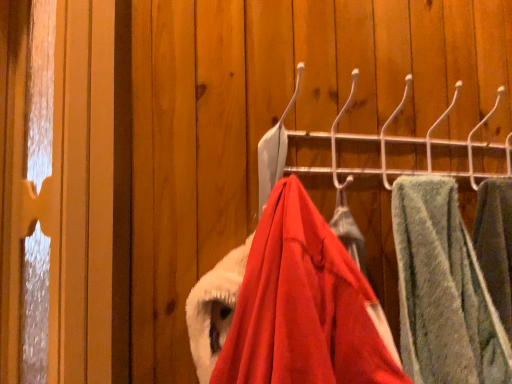
Question: Which direction should I rotate to face velvet red coat at center, which is the 2th closet in top-to-bottom order, — up or down?

Choices:
 (A) up
 (B) down

Answer: (B)

Question: Considering the relative sizes of metallic hook rack at center, which ranks as the second closet in bottom-to-top order, and green fuzzy towel at right in the image provided, is metallic hook rack at center, which ranks as the second closet in bottom-to-top order, wider than green fuzzy towel at right?

Choices:
 (A) yes
 (B) no

Answer: (B)

Question: Is metallic hook rack at center, which ranks as the second closet in bottom-to-top order, to the right of green fuzzy towel at right from the viewer's perspective?

Choices:
 (A) no
 (B) yes

Answer: (A)

Question: Is metallic hook rack at center, which ranks as the second closet in bottom-to-top order, not near green fuzzy towel at right?

Choices:
 (A) no
 (B) yes

Answer: (A)

Question: Considering the relative sizes of metallic hook rack at center, which ranks as the 1th closet in top-to-bottom order, and green fuzzy towel at right in the image provided, is metallic hook rack at center, which ranks as the 1th closet in top-to-bottom order, thinner than green fuzzy towel at right?

Choices:
 (A) yes
 (B) no

Answer: (A)

Question: Can you confirm if metallic hook rack at center, which ranks as the 1th closet in top-to-bottom order, is positioned to the left of green fuzzy towel at right?

Choices:
 (A) yes
 (B) no

Answer: (A)

Question: Can you confirm if metallic hook rack at center, which ranks as the second closet in bottom-to-top order, is smaller than green fuzzy towel at right?

Choices:
 (A) yes
 (B) no

Answer: (B)

Question: Does green fuzzy towel at right contain velvet red coat at center, which is the 2th closet in top-to-bottom order?

Choices:
 (A) yes
 (B) no

Answer: (B)

Question: From the image's perspective, is green fuzzy towel at right beneath velvet red coat at center, which is the 2th closet in top-to-bottom order?

Choices:
 (A) yes
 (B) no

Answer: (A)

Question: Is the position of green fuzzy towel at right more distant than that of velvet red coat at center, which is the 2th closet in top-to-bottom order?

Choices:
 (A) yes
 (B) no

Answer: (A)

Question: Is green fuzzy towel at right positioned beyond the bounds of velvet red coat at center, the 1th closet positioned from the bottom?

Choices:
 (A) no
 (B) yes

Answer: (B)

Question: From the image's perspective, is green fuzzy towel at right on top of velvet red coat at center, the 1th closet positioned from the bottom?

Choices:
 (A) yes
 (B) no

Answer: (B)

Question: Is green fuzzy towel at right not near velvet red coat at center, which is the 2th closet in top-to-bottom order?

Choices:
 (A) no
 (B) yes

Answer: (A)

Question: Can you confirm if velvet red coat at center, the 1th closet positioned from the bottom, is shorter than metallic hook rack at center, which ranks as the second closet in bottom-to-top order?

Choices:
 (A) yes
 (B) no

Answer: (B)